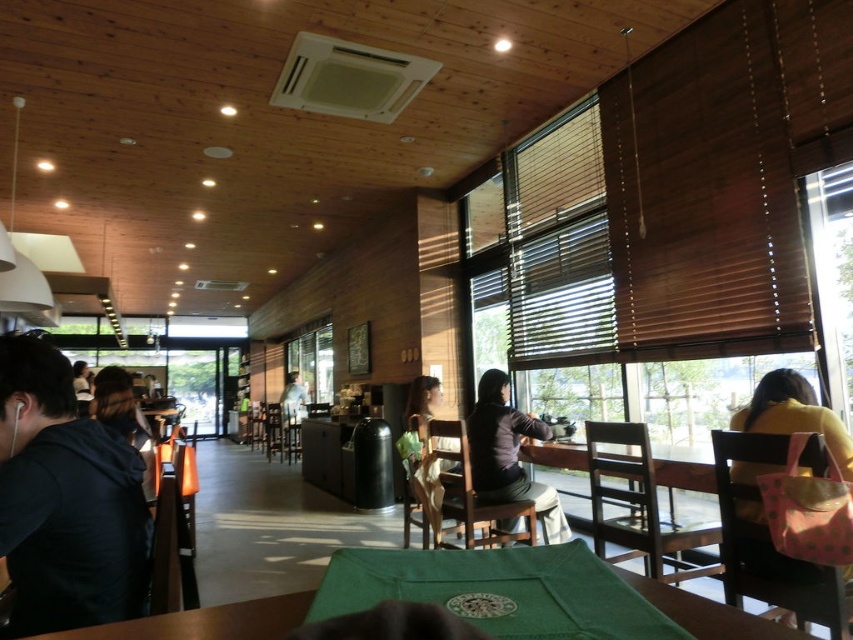
Question: Can you confirm if yellow matte jacket at right is bigger than light brown wooden chair at center?

Choices:
 (A) yes
 (B) no

Answer: (B)

Question: Can you confirm if green fabric table at center is positioned to the left of matte black shirt at center?

Choices:
 (A) yes
 (B) no

Answer: (A)

Question: Which of these objects is positioned closest to the green fabric table at center?

Choices:
 (A) matte black shirt at center
 (B) dark brown hair at left
 (C) light brown wooden chair at center
 (D) yellow matte jacket at right

Answer: (D)

Question: Which point is farther from the camera taking this photo?

Choices:
 (A) (297, 372)
 (B) (49, 577)
 (C) (670, 596)

Answer: (A)

Question: Is green fabric table at center thinner than yellow matte jacket at right?

Choices:
 (A) no
 (B) yes

Answer: (A)

Question: Which object is the farthest from the dark brown hair at left?

Choices:
 (A) light brown wooden chair at center
 (B) yellow matte jacket at right

Answer: (A)